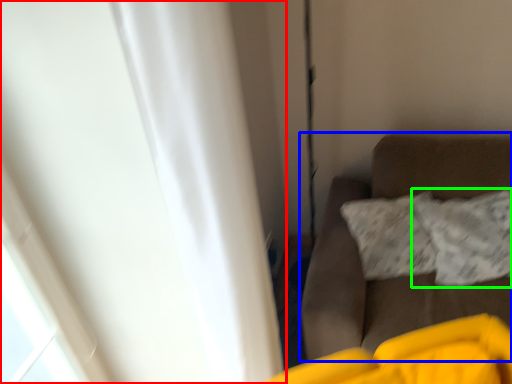
Question: Which is nearer to the curtain (highlighted by a red box)? furniture (highlighted by a blue box) or pillow (highlighted by a green box).

Choices:
 (A) furniture
 (B) pillow

Answer: (A)